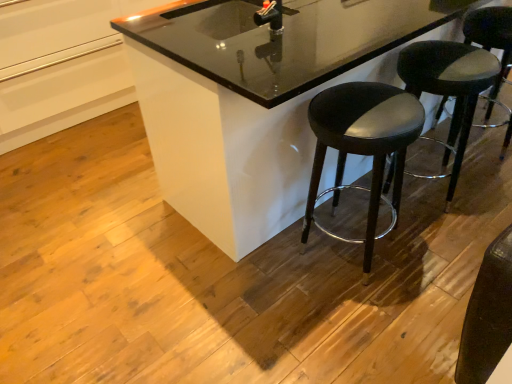
At what (x,y) coordinates should I click in order to perform the action: click on free space in front of black leather stool at lower right, which is the second stool from right to left. Please return your answer as a coordinate pair (x, y). The height and width of the screenshot is (384, 512). Looking at the image, I should click on (441, 244).